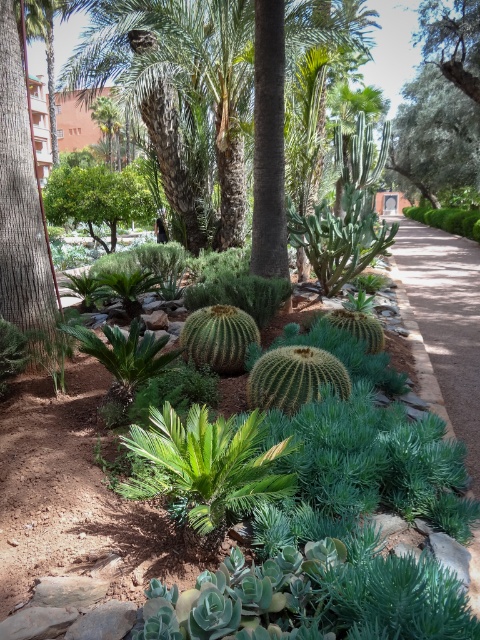
Question: Observing the image, what is the correct spatial positioning of green textured tree at left in reference to dirt/gravel pathway at center?

Choices:
 (A) right
 (B) left

Answer: (B)

Question: Can you confirm if green textured tree at left is thinner than dirt/gravel pathway at center?

Choices:
 (A) yes
 (B) no

Answer: (A)

Question: Is green textured tree at left thinner than dirt/gravel pathway at center?

Choices:
 (A) yes
 (B) no

Answer: (A)

Question: Which of these objects is positioned closest to the green leafy tree at upper right?

Choices:
 (A) dirt/gravel pathway at center
 (B) green textured tree at left

Answer: (A)

Question: Estimate the real-world distances between objects in this image. Which object is farther from the green textured tree at left?

Choices:
 (A) dirt/gravel pathway at center
 (B) green leafy tree at upper right

Answer: (B)

Question: Which point is farther to the camera?

Choices:
 (A) (476, 243)
 (B) (6, 241)

Answer: (A)